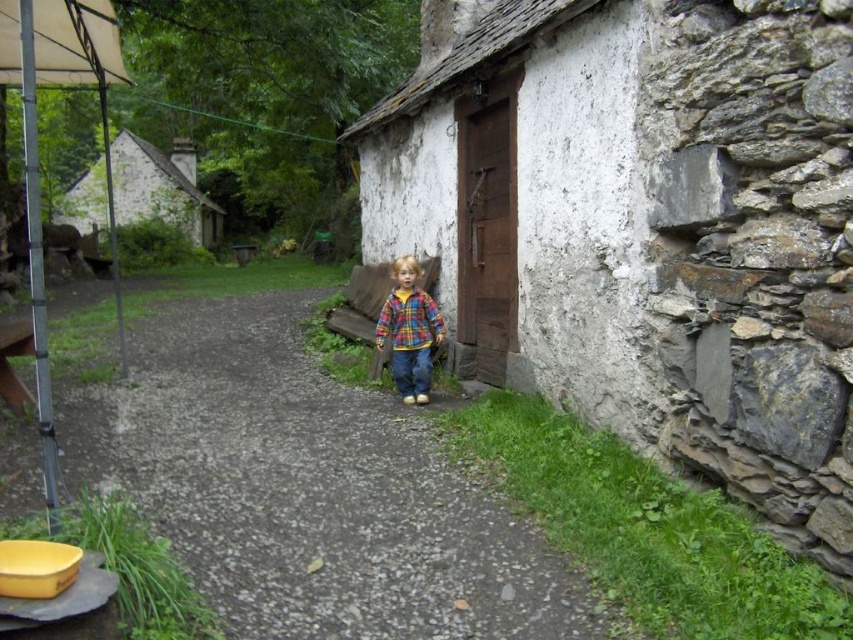
Is white plastered wall at center to the left of white stone hut at upper left from the viewer's perspective?

In fact, white plastered wall at center is to the right of white stone hut at upper left.

Is white plastered wall at center positioned before white stone hut at upper left?

Yes, white plastered wall at center is closer to the viewer.

Is point (363, 248) in front of point (192, 212)?

That is True.

Find the location of a particular element. Image resolution: width=853 pixels, height=640 pixels. white plastered wall at center is located at coordinates (643, 227).

Can you confirm if white stone hut at upper left is wider than plaid fabric shirt at center?

Yes.

Between white stone hut at upper left and plaid fabric shirt at center, which one is positioned lower?

plaid fabric shirt at center

Between point (119, 173) and point (424, 369), which one is positioned behind?

The point (119, 173) is behind.

The height and width of the screenshot is (640, 853). What are the coordinates of `white stone hut at upper left` in the screenshot? It's located at (161, 188).

Who is positioned more to the right, white plastered wall at center or gravel path at center?

Positioned to the right is white plastered wall at center.

Who is more distant from viewer, (749, 172) or (74, 481)?

The point (74, 481) is behind.

Does point (726, 166) come farther from viewer compared to point (144, 380)?

That is False.

I want to click on white plastered wall at center, so click(643, 227).